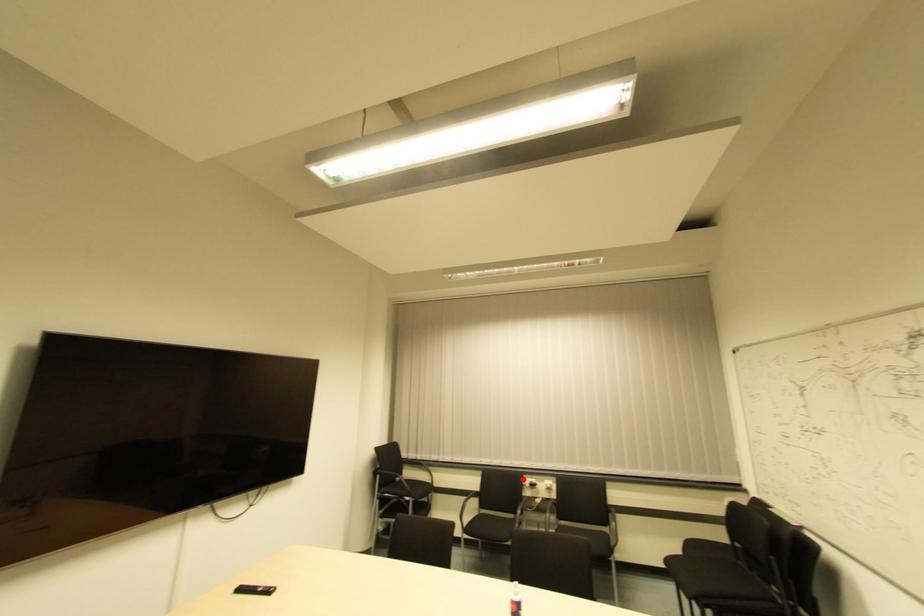
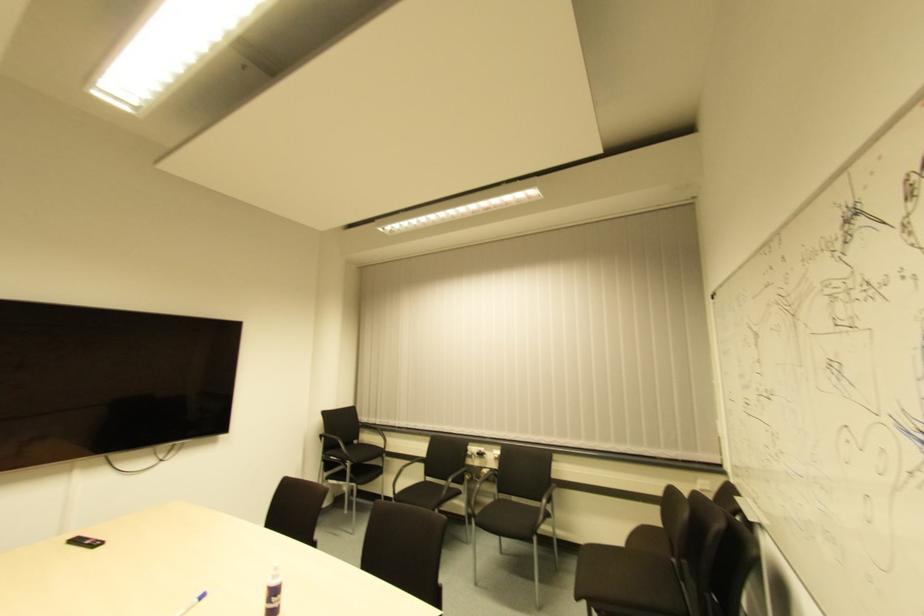
Where in the second image is the point corresponding to the highlighted location from the first image?

(468, 447)